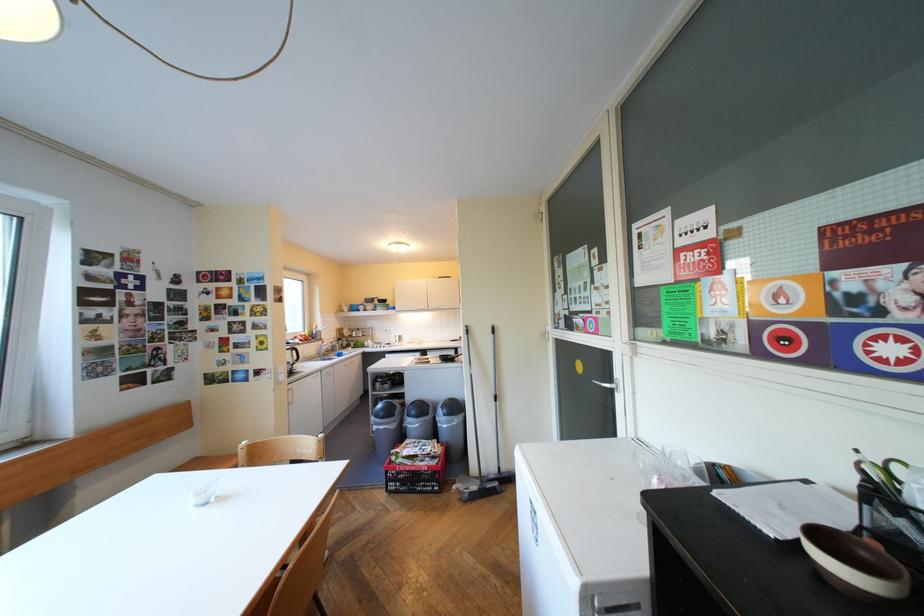
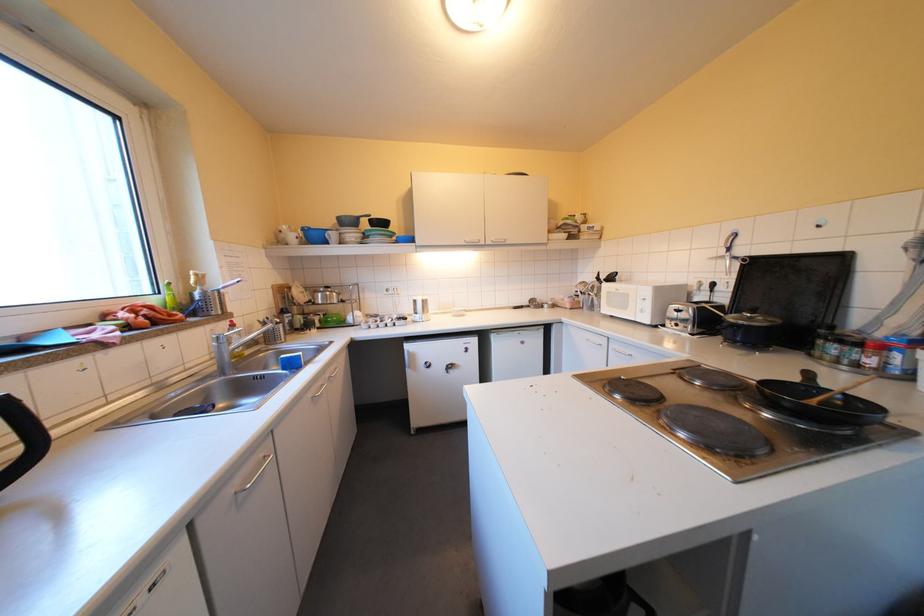
Which direction would the cameraman need to move to produce the second image?

The cameraman walked toward left, forward.